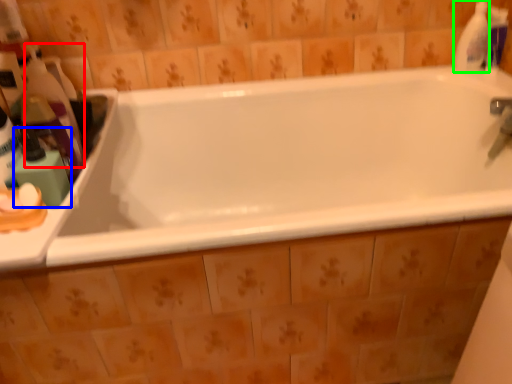
Question: Based on their relative distances, which object is nearer to cleaning product (highlighted by a red box)? Choose from toiletry (highlighted by a blue box) and cleaning product (highlighted by a green box).

Choices:
 (A) toiletry
 (B) cleaning product

Answer: (A)